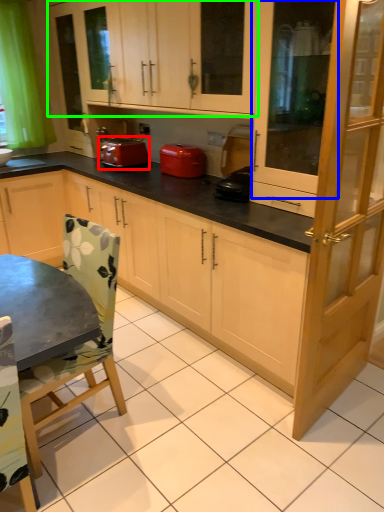
Question: Which object is positioned farthest from kitchen appliance (highlighted by a red box)? Select from screen door (highlighted by a blue box) and cabinetry (highlighted by a green box).

Choices:
 (A) screen door
 (B) cabinetry

Answer: (A)